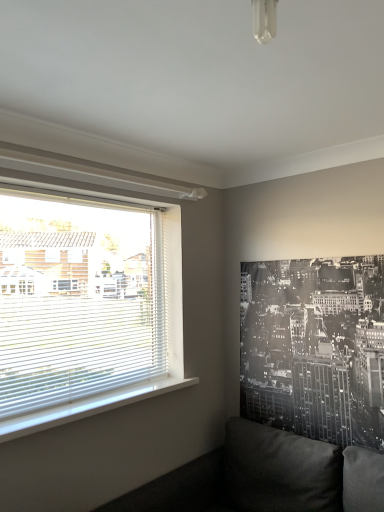
What is the approximate width of dark gray fabric couch at lower right?

The width of dark gray fabric couch at lower right is 31.56 inches.

At what (x,y) coordinates should I click in order to perform the action: click on dark gray fabric couch at lower right. Please return your answer as a coordinate pair (x, y). Image resolution: width=384 pixels, height=512 pixels. Looking at the image, I should click on tap(247, 477).

This screenshot has height=512, width=384. What do you see at coordinates (247, 477) in the screenshot?
I see `dark gray fabric couch at lower right` at bounding box center [247, 477].

Where is `dark gray fabric couch at lower right`? The image size is (384, 512). dark gray fabric couch at lower right is located at coordinates (247, 477).